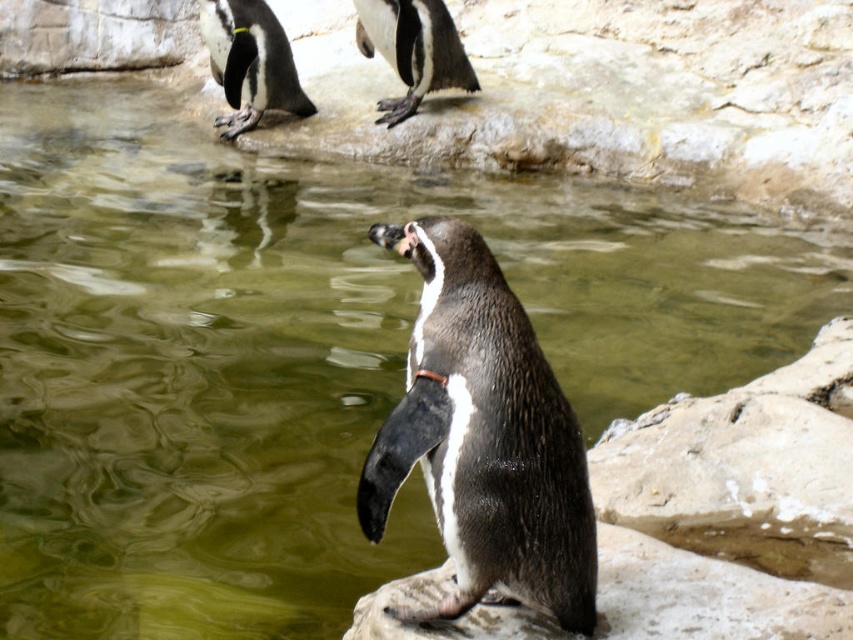
Question: Where is black glossy penguin at center located in relation to black glossy penguin at upper center in the image?

Choices:
 (A) below
 (B) above

Answer: (A)

Question: Which is nearer to the black glossy penguin at upper left?

Choices:
 (A) black glossy penguin at center
 (B) black glossy penguin at upper center

Answer: (B)

Question: Does black glossy penguin at center come behind black glossy penguin at upper left?

Choices:
 (A) no
 (B) yes

Answer: (A)

Question: Among these points, which one is nearest to the camera?

Choices:
 (A) (486, 387)
 (B) (219, 76)

Answer: (A)

Question: Does black glossy penguin at center appear on the left side of black glossy penguin at upper center?

Choices:
 (A) no
 (B) yes

Answer: (A)

Question: Which is nearer to the black glossy penguin at center?

Choices:
 (A) black glossy penguin at upper left
 (B) black glossy penguin at upper center

Answer: (B)